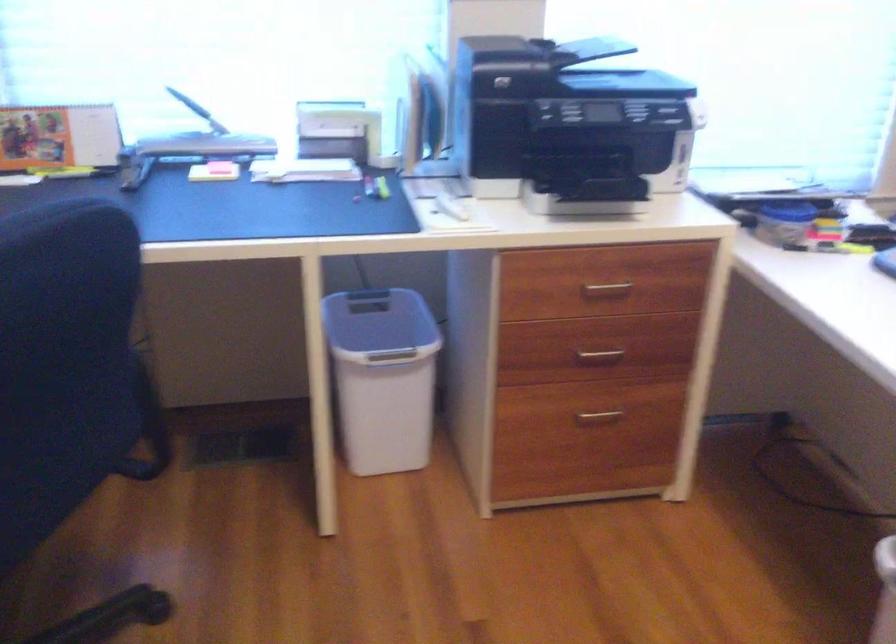
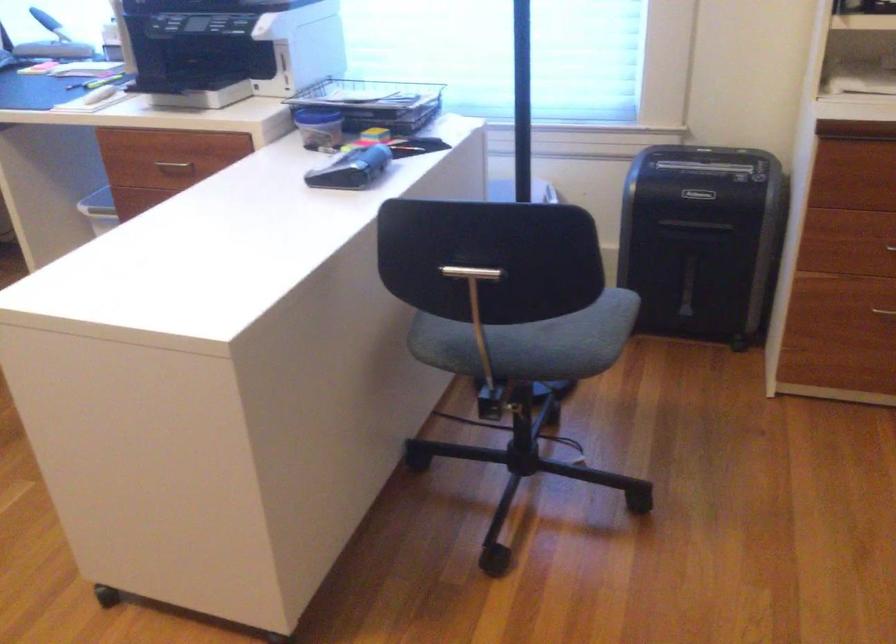
The point at [800,200] is marked in the first image. Where is the corresponding point in the second image?

(374, 102)